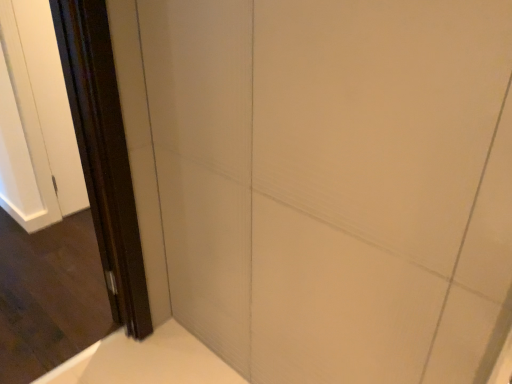
What do you see at coordinates (104, 155) in the screenshot?
I see `dark brown wood screen door at left, which is the 2th screen door in front-to-back order` at bounding box center [104, 155].

Locate an element on the screen. This screenshot has height=384, width=512. dark brown wood screen door at left, which is the 2th screen door in front-to-back order is located at coordinates (104, 155).

What do you see at coordinates (8, 295) in the screenshot? I see `dark brown wood screen door at left, which is the first screen door from front to back` at bounding box center [8, 295].

Locate an element on the screen. The image size is (512, 384). dark brown wood screen door at left, the 2th screen door viewed from the back is located at coordinates (8, 295).

Locate an element on the screen. The image size is (512, 384). dark brown wood screen door at left, positioned as the first screen door in back-to-front order is located at coordinates (104, 155).

Can you confirm if dark brown wood screen door at left, positioned as the first screen door in back-to-front order, is positioned to the left of dark brown wood screen door at left, which is the first screen door from front to back?

No.

Between dark brown wood screen door at left, which is the 2th screen door in front-to-back order, and dark brown wood screen door at left, which is the first screen door from front to back, which one is positioned in front?

dark brown wood screen door at left, which is the first screen door from front to back.

Is point (106, 30) more distant than point (12, 297)?

No, it is in front of (12, 297).

From the image's perspective, is dark brown wood screen door at left, positioned as the first screen door in back-to-front order, located above or below dark brown wood screen door at left, which is the first screen door from front to back?

dark brown wood screen door at left, positioned as the first screen door in back-to-front order, is above dark brown wood screen door at left, which is the first screen door from front to back.

From a real-world perspective, which object stands above the other?

dark brown wood screen door at left, which is the first screen door from front to back.

Considering the sizes of dark brown wood screen door at left, which is the 2th screen door in front-to-back order, and dark brown wood screen door at left, which is the first screen door from front to back, in the image, is dark brown wood screen door at left, which is the 2th screen door in front-to-back order, wider or thinner than dark brown wood screen door at left, which is the first screen door from front to back,?

Considering their sizes, dark brown wood screen door at left, which is the 2th screen door in front-to-back order, looks slimmer than dark brown wood screen door at left, which is the first screen door from front to back.

Does dark brown wood screen door at left, positioned as the first screen door in back-to-front order, have a greater height compared to dark brown wood screen door at left, the 2th screen door viewed from the back?

In fact, dark brown wood screen door at left, positioned as the first screen door in back-to-front order, may be shorter than dark brown wood screen door at left, the 2th screen door viewed from the back.

Which of these two, dark brown wood screen door at left, positioned as the first screen door in back-to-front order, or dark brown wood screen door at left, which is the first screen door from front to back, is smaller?

dark brown wood screen door at left, positioned as the first screen door in back-to-front order.

Which is correct: dark brown wood screen door at left, which is the 2th screen door in front-to-back order, is inside dark brown wood screen door at left, which is the first screen door from front to back, or outside of it?

dark brown wood screen door at left, which is the 2th screen door in front-to-back order, cannot be found inside dark brown wood screen door at left, which is the first screen door from front to back.

Are dark brown wood screen door at left, which is the 2th screen door in front-to-back order, and dark brown wood screen door at left, which is the first screen door from front to back, making contact?

No, dark brown wood screen door at left, which is the 2th screen door in front-to-back order, is not beside dark brown wood screen door at left, which is the first screen door from front to back.

Is dark brown wood screen door at left, positioned as the first screen door in back-to-front order, facing away from dark brown wood screen door at left, the 2th screen door viewed from the back?

That's not correct — dark brown wood screen door at left, positioned as the first screen door in back-to-front order, is not looking away from dark brown wood screen door at left, the 2th screen door viewed from the back.

What's the angular difference between dark brown wood screen door at left, which is the 2th screen door in front-to-back order, and dark brown wood screen door at left, which is the first screen door from front to back,'s facing directions?

dark brown wood screen door at left, which is the 2th screen door in front-to-back order, and dark brown wood screen door at left, which is the first screen door from front to back, are facing 114 degrees away from each other.

Identify the location of screen door behind the dark brown wood screen door at left, the 2th screen door viewed from the back. This screenshot has width=512, height=384. (104, 155).

Between dark brown wood screen door at left, the 2th screen door viewed from the back, and dark brown wood screen door at left, which is the 2th screen door in front-to-back order, which one appears on the right side from the viewer's perspective?

Positioned to the right is dark brown wood screen door at left, which is the 2th screen door in front-to-back order.

Is dark brown wood screen door at left, which is the first screen door from front to back, further to the viewer compared to dark brown wood screen door at left, which is the 2th screen door in front-to-back order?

No, it is in front of dark brown wood screen door at left, which is the 2th screen door in front-to-back order.

Which point is more forward, (105, 256) or (99, 231)?

Point (99, 231)

From the image's perspective, between dark brown wood screen door at left, which is the first screen door from front to back, and dark brown wood screen door at left, which is the 2th screen door in front-to-back order, which one is located above?

dark brown wood screen door at left, which is the 2th screen door in front-to-back order, is shown above in the image.

From a real-world perspective, is dark brown wood screen door at left, the 2th screen door viewed from the back, above or below dark brown wood screen door at left, positioned as the first screen door in back-to-front order?

dark brown wood screen door at left, the 2th screen door viewed from the back, is situated higher than dark brown wood screen door at left, positioned as the first screen door in back-to-front order, in the real world.

Considering the relative sizes of dark brown wood screen door at left, the 2th screen door viewed from the back, and dark brown wood screen door at left, which is the 2th screen door in front-to-back order, in the image provided, is dark brown wood screen door at left, the 2th screen door viewed from the back, thinner than dark brown wood screen door at left, which is the 2th screen door in front-to-back order,?

A: Incorrect, the width of dark brown wood screen door at left, the 2th screen door viewed from the back, is not less than that of dark brown wood screen door at left, which is the 2th screen door in front-to-back order.

Who is shorter, dark brown wood screen door at left, the 2th screen door viewed from the back, or dark brown wood screen door at left, positioned as the first screen door in back-to-front order?

With less height is dark brown wood screen door at left, positioned as the first screen door in back-to-front order.

Does dark brown wood screen door at left, the 2th screen door viewed from the back, have a smaller size compared to dark brown wood screen door at left, which is the 2th screen door in front-to-back order?

No, dark brown wood screen door at left, the 2th screen door viewed from the back, is not smaller than dark brown wood screen door at left, which is the 2th screen door in front-to-back order.

Can dark brown wood screen door at left, positioned as the first screen door in back-to-front order, be found inside dark brown wood screen door at left, the 2th screen door viewed from the back?

That's incorrect, dark brown wood screen door at left, positioned as the first screen door in back-to-front order, is not inside dark brown wood screen door at left, the 2th screen door viewed from the back.

Can you see dark brown wood screen door at left, the 2th screen door viewed from the back, touching dark brown wood screen door at left, which is the 2th screen door in front-to-back order?

No, dark brown wood screen door at left, the 2th screen door viewed from the back, is not beside dark brown wood screen door at left, which is the 2th screen door in front-to-back order.

Is dark brown wood screen door at left, the 2th screen door viewed from the back, facing towards dark brown wood screen door at left, positioned as the first screen door in back-to-front order?

No, dark brown wood screen door at left, the 2th screen door viewed from the back, is not oriented towards dark brown wood screen door at left, positioned as the first screen door in back-to-front order.

Based on the photo, how many degrees apart are the facing directions of dark brown wood screen door at left, the 2th screen door viewed from the back, and dark brown wood screen door at left, positioned as the first screen door in back-to-front order?

114 degrees separate the facing orientations of dark brown wood screen door at left, the 2th screen door viewed from the back, and dark brown wood screen door at left, positioned as the first screen door in back-to-front order.

Measure the distance from dark brown wood screen door at left, the 2th screen door viewed from the back, to dark brown wood screen door at left, positioned as the first screen door in back-to-front order.

dark brown wood screen door at left, the 2th screen door viewed from the back, and dark brown wood screen door at left, positioned as the first screen door in back-to-front order, are 31.01 inches apart from each other.

At what (x,y) coordinates should I click in order to perform the action: click on screen door above the dark brown wood screen door at left, which is the first screen door from front to back (from the image's perspective). Please return your answer as a coordinate pair (x, y). This screenshot has height=384, width=512. Looking at the image, I should click on (104, 155).

Image resolution: width=512 pixels, height=384 pixels. Find the location of `screen door behind the dark brown wood screen door at left, which is the first screen door from front to back`. screen door behind the dark brown wood screen door at left, which is the first screen door from front to back is located at coordinates (104, 155).

Image resolution: width=512 pixels, height=384 pixels. I want to click on screen door located on the right of dark brown wood screen door at left, which is the first screen door from front to back, so click(104, 155).